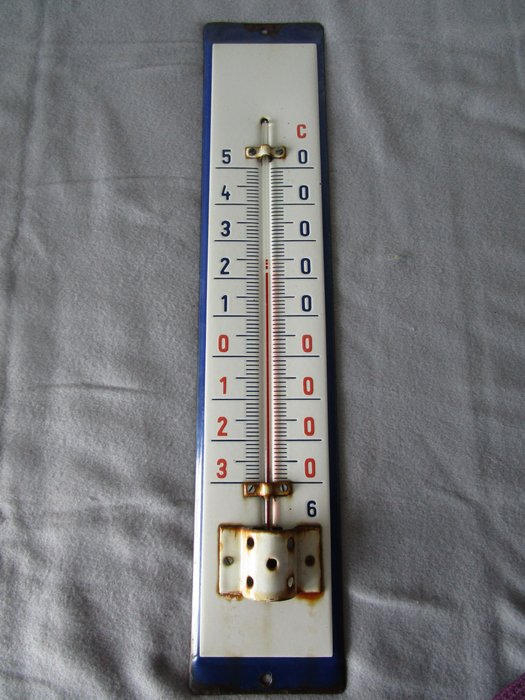
Locate an element on the screen. This screenshot has width=525, height=700. brass plate is located at coordinates (265, 489).